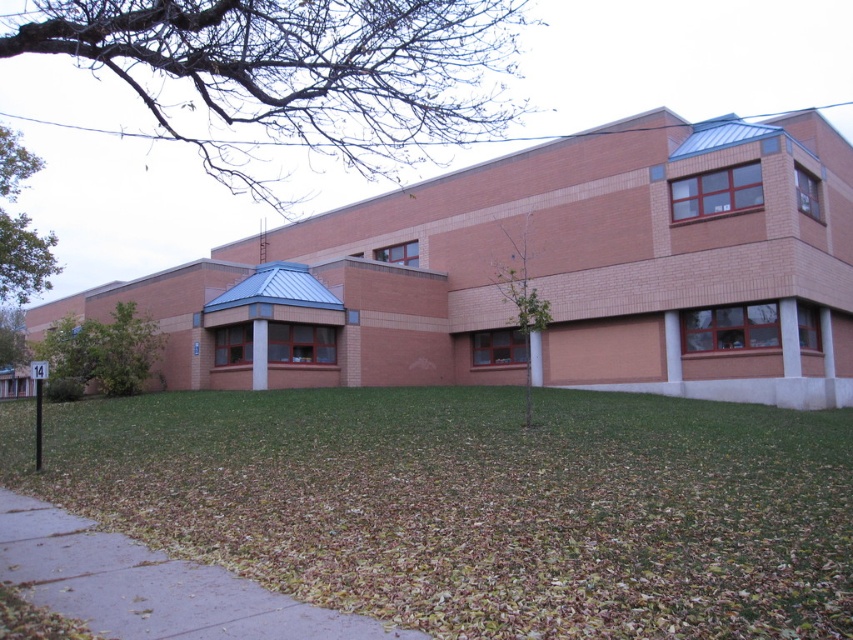
Does green grass at lower center have a greater height compared to brown concrete sidewalk at lower left?

Yes.

Can you confirm if green grass at lower center is thinner than brown concrete sidewalk at lower left?

No.

Identify the location of green grass at lower center. The image size is (853, 640). (477, 502).